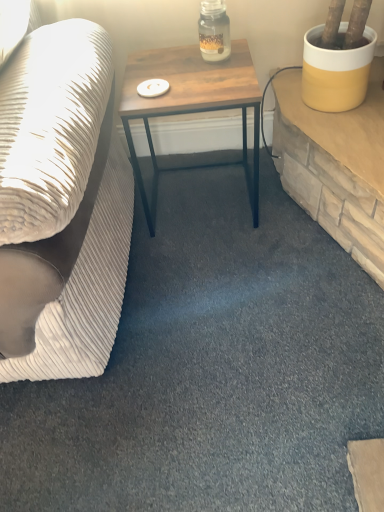
Question: Is white textured fabric couch at left outside wooden table at center?

Choices:
 (A) no
 (B) yes

Answer: (B)

Question: Is white textured fabric couch at left surrounding wooden table at center?

Choices:
 (A) no
 (B) yes

Answer: (A)

Question: Are white textured fabric couch at left and wooden table at center making contact?

Choices:
 (A) yes
 (B) no

Answer: (B)

Question: Is white textured fabric couch at left thinner than wooden table at center?

Choices:
 (A) no
 (B) yes

Answer: (A)

Question: Is white textured fabric couch at left facing towards wooden table at center?

Choices:
 (A) yes
 (B) no

Answer: (B)

Question: From the image's perspective, is white textured fabric couch at left located above or below wooden table at center?

Choices:
 (A) above
 (B) below

Answer: (A)

Question: Which is correct: white textured fabric couch at left is inside wooden table at center, or outside of it?

Choices:
 (A) outside
 (B) inside

Answer: (A)

Question: Is white textured fabric couch at left wider or thinner than wooden table at center?

Choices:
 (A) wide
 (B) thin

Answer: (A)

Question: From a real-world perspective, is white textured fabric couch at left positioned above or below wooden table at center?

Choices:
 (A) below
 (B) above

Answer: (B)

Question: Considering their positions, is translucent glass jar at center located in front of or behind white textured fabric couch at left?

Choices:
 (A) behind
 (B) front

Answer: (A)

Question: Is translucent glass jar at center situated inside white textured fabric couch at left or outside?

Choices:
 (A) outside
 (B) inside

Answer: (A)

Question: From a real-world perspective, is translucent glass jar at center physically located above or below white textured fabric couch at left?

Choices:
 (A) above
 (B) below

Answer: (A)

Question: In the image, is translucent glass jar at center on the left side or the right side of white textured fabric couch at left?

Choices:
 (A) left
 (B) right

Answer: (B)

Question: Would you say translucent glass jar at center is to the left or to the right of wooden table at center in the picture?

Choices:
 (A) right
 (B) left

Answer: (A)

Question: In terms of size, does translucent glass jar at center appear bigger or smaller than wooden table at center?

Choices:
 (A) big
 (B) small

Answer: (B)